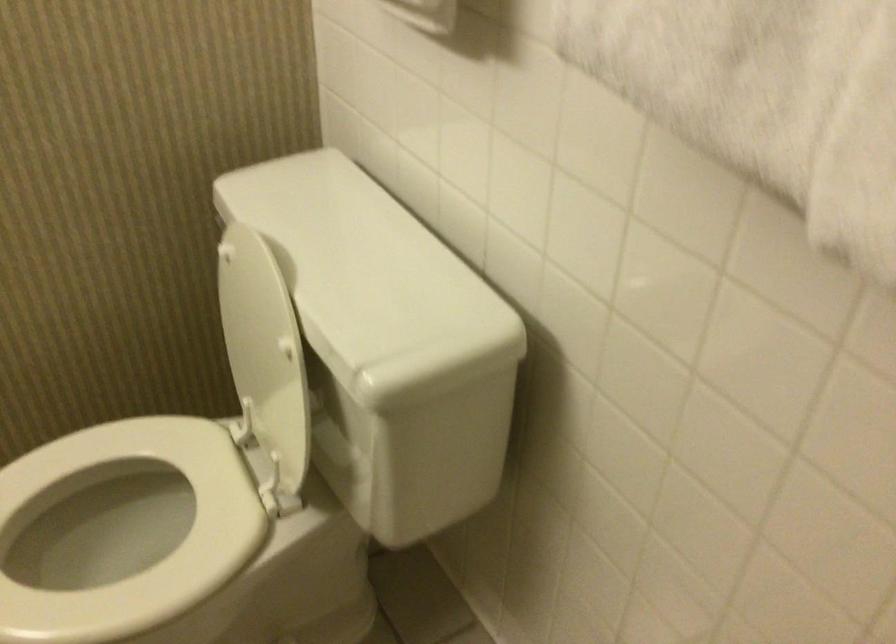
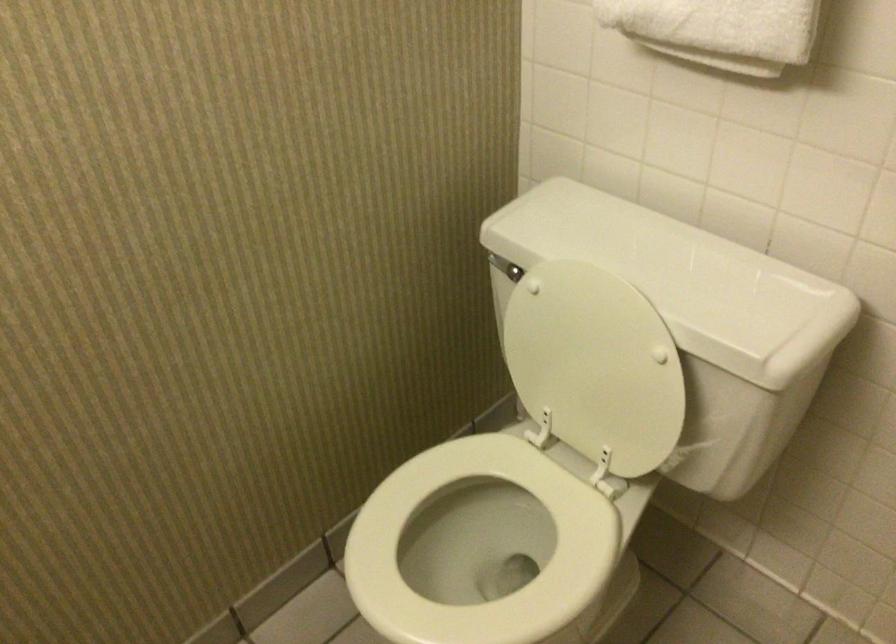
Question: The first image is from the beginning of the video and the second image is from the end. How did the camera likely rotate when shooting the video?

Choices:
 (A) Left
 (B) Right
 (C) Up
 (D) Down

Answer: (B)